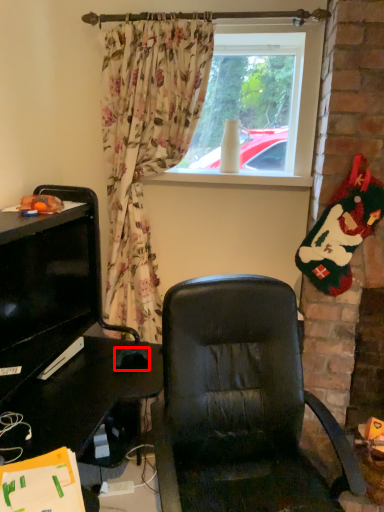
Question: From the image's perspective, where is mouse (annotated by the red box) located in relation to window screen in the image?

Choices:
 (A) below
 (B) above

Answer: (A)